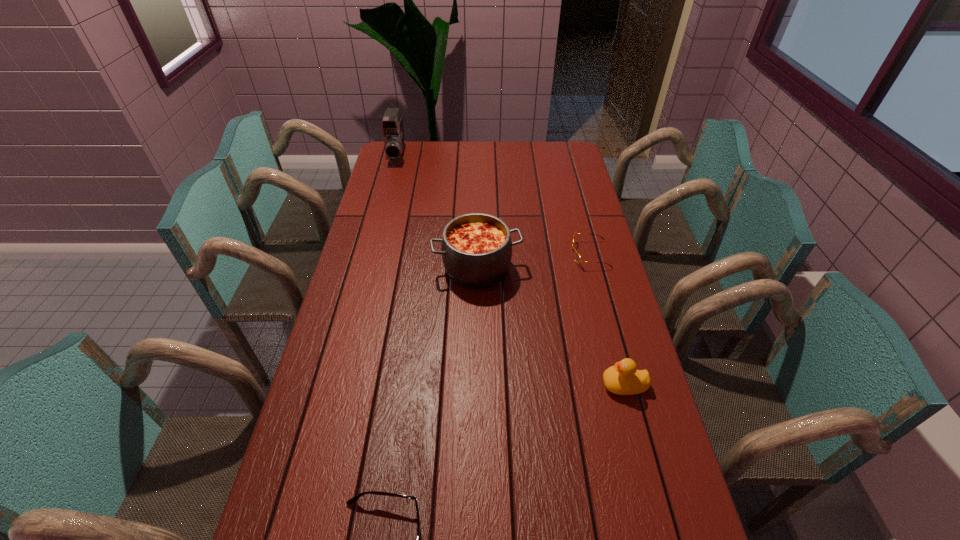
I want to click on the tallest object, so click(392, 124).

Where is `the leftmost object`? The height and width of the screenshot is (540, 960). the leftmost object is located at coordinates (392, 124).

Image resolution: width=960 pixels, height=540 pixels. Find the location of `the fourth shortest object`. the fourth shortest object is located at coordinates (476, 249).

You are a GUI agent. You are given a task and a screenshot of the screen. Output one action in this format:
    pyautogui.click(x=<x>, y=<y>)
    Task: Click on the duck
    
    Given the screenshot: What is the action you would take?
    pyautogui.click(x=623, y=379)

Where is `the third shortest object`? This screenshot has width=960, height=540. the third shortest object is located at coordinates (623, 379).

Where is `the farther spectacles`? the farther spectacles is located at coordinates (577, 257).

You are a GUI agent. You are given a task and a screenshot of the screen. Output one action in this format:
    pyautogui.click(x=<x>, y=<y>)
    Task: Click on the vacant space situated 0.200m at the front of the farthest object, highlighting the lens
    The height and width of the screenshot is (540, 960).
    Given the screenshot: What is the action you would take?
    tap(387, 194)

Locate an element on the screen. This screenshot has width=960, height=540. free point located 0.310m on the front of the fourth shortest object is located at coordinates (476, 379).

Locate an element on the screen. vacant region located on the face of the third shortest object is located at coordinates (557, 385).

Identify the location of vacant point located on the face of the third shortest object. Image resolution: width=960 pixels, height=540 pixels. (518, 385).